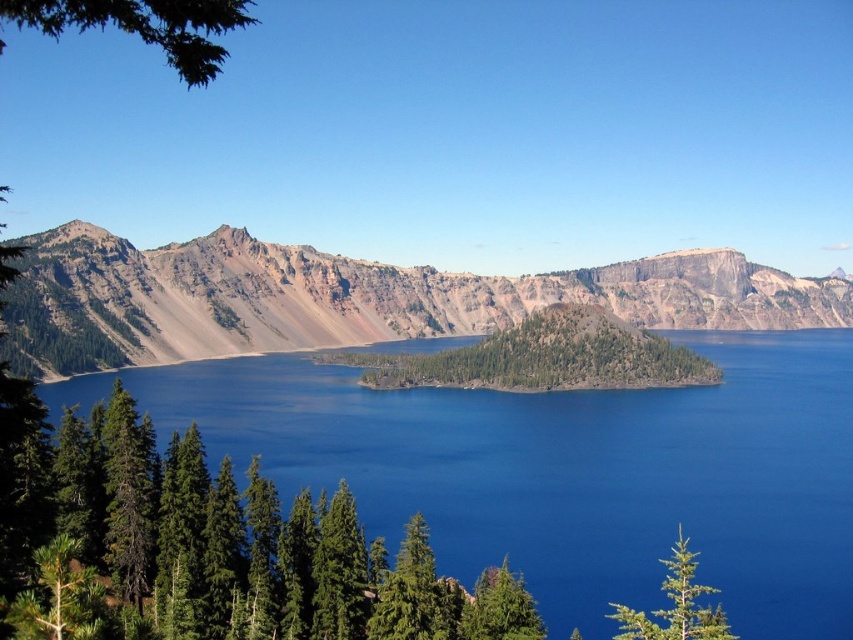
Question: Can you confirm if green leafy island at center is positioned to the right of green leafy tree at upper left?

Choices:
 (A) no
 (B) yes

Answer: (B)

Question: Which of the following is the farthest from the observer?

Choices:
 (A) (450, 605)
 (B) (534, 609)
 (C) (776, 419)
 (D) (160, 29)

Answer: (C)

Question: Which object appears farthest from the camera in this image?

Choices:
 (A) green needle-like tree at lower left
 (B) green matte tree at lower right

Answer: (B)

Question: In this image, where is green leafy island at center located relative to green matte tree at lower right?

Choices:
 (A) left
 (B) right

Answer: (A)

Question: Which object is closer to the camera taking this photo?

Choices:
 (A) green leafy tree at upper left
 (B) green matte tree at lower center
 (C) blue water at center
 (D) green needle-like tree at lower left

Answer: (D)

Question: Is brown rocky mountain at left above green matte tree at lower right?

Choices:
 (A) no
 (B) yes

Answer: (B)